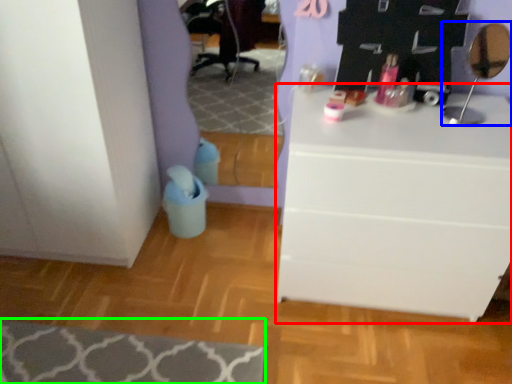
Question: Estimate the real-world distances between objects in this image. Which object is closer to chest of drawers (highlighted by a red box), mirror (highlighted by a blue box) or mat (highlighted by a green box)?

Choices:
 (A) mirror
 (B) mat

Answer: (A)